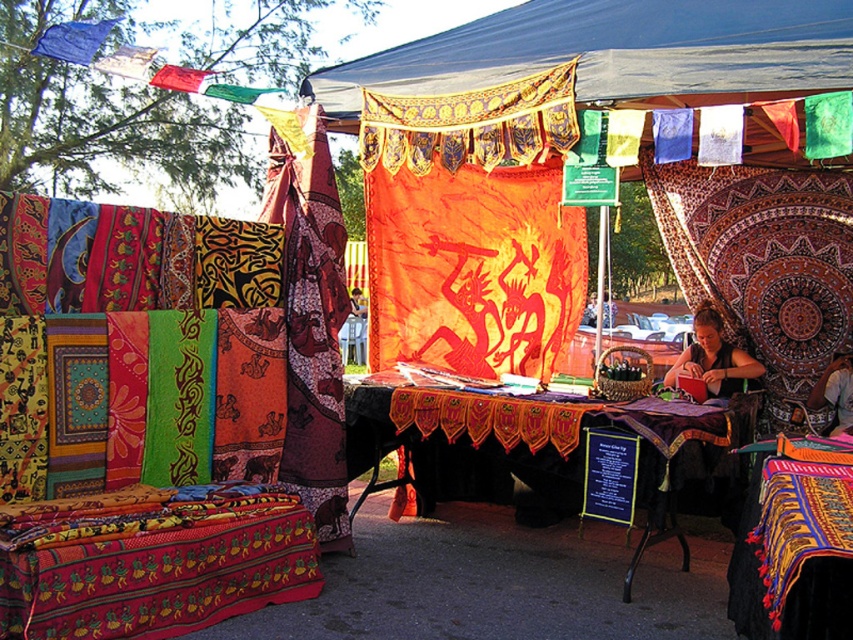
Who is taller, multicolored woven cloth at center or matte black fabric at center?

With more height is multicolored woven cloth at center.

Is multicolored woven cloth at center shorter than matte black fabric at center?

No, multicolored woven cloth at center is not shorter than matte black fabric at center.

Is point (769, 540) farther from viewer compared to point (703, 378)?

That is False.

Locate an element on the screen. The width and height of the screenshot is (853, 640). multicolored woven cloth at center is located at coordinates (793, 554).

From the picture: Is vibrant woven quilt at lower left to the right of matte black table at center from the viewer's perspective?

No, vibrant woven quilt at lower left is not to the right of matte black table at center.

You are a GUI agent. You are given a task and a screenshot of the screen. Output one action in this format:
    pyautogui.click(x=<x>, y=<y>)
    Task: Click on the vibrant woven quilt at lower left
    Image resolution: width=853 pixels, height=640 pixels.
    Given the screenshot: What is the action you would take?
    pyautogui.click(x=151, y=561)

Does vibrant woven quilt at lower left appear on the left side of multicolored woven cloth at center?

Indeed, vibrant woven quilt at lower left is positioned on the left side of multicolored woven cloth at center.

Can you confirm if vibrant woven quilt at lower left is wider than multicolored woven cloth at center?

Correct, the width of vibrant woven quilt at lower left exceeds that of multicolored woven cloth at center.

Who is more distant from viewer, [146,561] or [744,572]?

Positioned behind is point [146,561].

At what (x,y) coordinates should I click in order to perform the action: click on vibrant woven quilt at lower left. Please return your answer as a coordinate pair (x, y). This screenshot has height=640, width=853. Looking at the image, I should click on (151, 561).